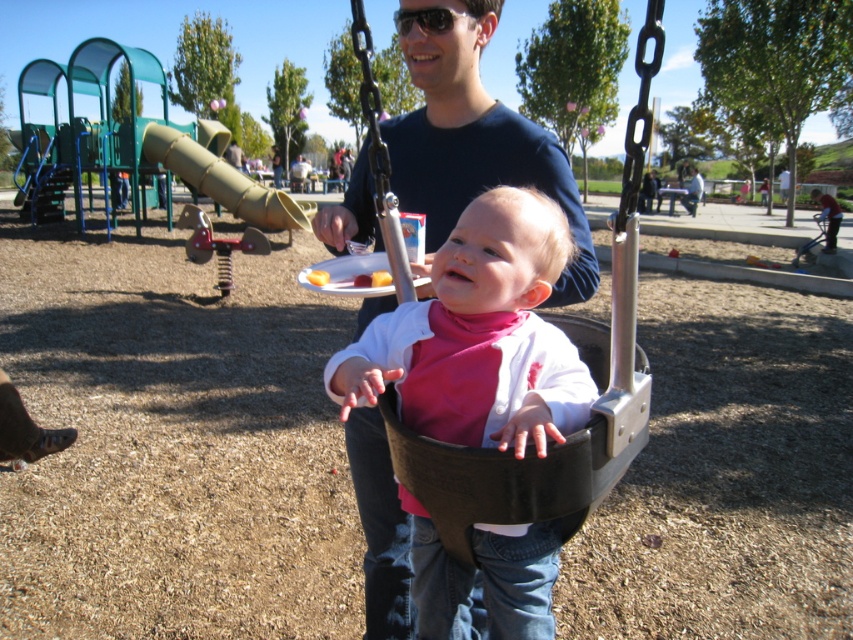
Question: Which object appears closest to the camera in this image?

Choices:
 (A) pink matte bib at center
 (B) black plastic swing at center

Answer: (B)

Question: Does pink matte bib at center lie in front of black plastic swing at center?

Choices:
 (A) no
 (B) yes

Answer: (A)

Question: Does pink matte bib at center have a larger size compared to black plastic swing at center?

Choices:
 (A) no
 (B) yes

Answer: (A)

Question: Is pink matte bib at center to the left of black plastic swing at center from the viewer's perspective?

Choices:
 (A) no
 (B) yes

Answer: (B)